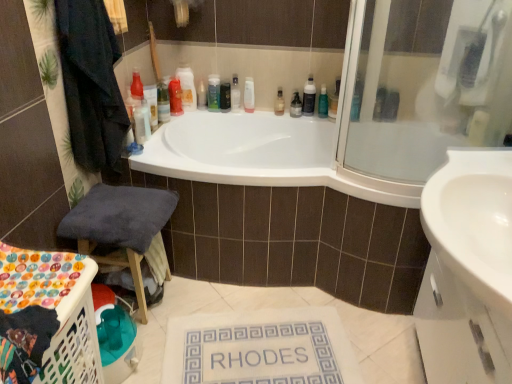
Locate an element on the screen. Image resolution: width=512 pixels, height=384 pixels. white glossy sink at lower right is located at coordinates (473, 221).

Locate an element on the screen. blue glass bottle at upper center, the 8th toiletry viewed from the left is located at coordinates (357, 99).

Find the location of `matte plastic bottle at upper center, which is the first toiletry in right-to-left order`. matte plastic bottle at upper center, which is the first toiletry in right-to-left order is located at coordinates (390, 105).

Locate an element on the screen. This screenshot has height=384, width=512. white glossy sink at lower right is located at coordinates (473, 221).

Which is more to the right, green matte bottle at upper center, the 7th toiletry positioned from the left, or matte orange bottle at upper center, the 2th cleaning product in the right-to-left sequence?

green matte bottle at upper center, the 7th toiletry positioned from the left.

Image resolution: width=512 pixels, height=384 pixels. I want to click on the 7th toiletry to the right when counting from the matte orange bottle at upper center, the 1th cleaning product in the left-to-right sequence, so click(x=323, y=103).

Is green matte bottle at upper center, the 7th toiletry positioned from the left, wider or thinner than matte orange bottle at upper center, the 1th cleaning product in the left-to-right sequence?

In the image, green matte bottle at upper center, the 7th toiletry positioned from the left, appears to be more narrow than matte orange bottle at upper center, the 1th cleaning product in the left-to-right sequence.

From a real-world perspective, who is located lower, green matte bottle at upper center, placed as the 4th toiletry when sorted from right to left, or matte orange bottle at upper center, the 1th cleaning product in the left-to-right sequence?

green matte bottle at upper center, placed as the 4th toiletry when sorted from right to left, is physically lower.

Does matte orange bottle at upper center, the 2th cleaning product in the right-to-left sequence, touch translucent plastic bottle at upper center, the 8th toiletry from the right?

No, matte orange bottle at upper center, the 2th cleaning product in the right-to-left sequence, is not in contact with translucent plastic bottle at upper center, the 8th toiletry from the right.

From a real-world perspective, between matte orange bottle at upper center, the 2th cleaning product in the right-to-left sequence, and translucent plastic bottle at upper center, the 3th toiletry from the left, who is vertically higher?

matte orange bottle at upper center, the 2th cleaning product in the right-to-left sequence.

Can you confirm if matte orange bottle at upper center, the 2th cleaning product in the right-to-left sequence, is positioned to the right of translucent plastic bottle at upper center, the 8th toiletry from the right?

No, matte orange bottle at upper center, the 2th cleaning product in the right-to-left sequence, is not to the right of translucent plastic bottle at upper center, the 8th toiletry from the right.

From a real-world perspective, who is located lower, translucent plastic bottle at upper center, the 3th toiletry from the left, or translucent plastic bottle at upper center, acting as the first toiletry starting from the left?

translucent plastic bottle at upper center, acting as the first toiletry starting from the left.

Is translucent plastic bottle at upper center, the 3th toiletry from the left, looking in the opposite direction of translucent plastic bottle at upper center, acting as the first toiletry starting from the left?

That's not correct — translucent plastic bottle at upper center, the 3th toiletry from the left, is not looking away from translucent plastic bottle at upper center, acting as the first toiletry starting from the left.

Does translucent plastic bottle at upper center, the 3th toiletry from the left, have a lesser height compared to translucent plastic bottle at upper center, which is the tenth toiletry in right-to-left order?

No, translucent plastic bottle at upper center, the 3th toiletry from the left, is not shorter than translucent plastic bottle at upper center, which is the tenth toiletry in right-to-left order.

Locate an element on the screen. toiletry located above the translucent plastic bottle at upper center, the 3th toiletry from the left (from the image's perspective) is located at coordinates (201, 95).

Does white plastic bottle at upper center, the 4th toiletry when ordered from left to right, touch green matte bottle at upper center?

No, white plastic bottle at upper center, the 4th toiletry when ordered from left to right, is not next to green matte bottle at upper center.

Is white plastic bottle at upper center, which is the seventh toiletry in right-to-left order, turned away from green matte bottle at upper center?

That's not correct — white plastic bottle at upper center, which is the seventh toiletry in right-to-left order, is not looking away from green matte bottle at upper center.

Considering the relative sizes of white plastic bottle at upper center, which is the seventh toiletry in right-to-left order, and green matte bottle at upper center in the image provided, is white plastic bottle at upper center, which is the seventh toiletry in right-to-left order, taller than green matte bottle at upper center?

No.

From the image's perspective, is white plastic bottle at upper center, which is the seventh toiletry in right-to-left order, above or below green matte bottle at upper center?

white plastic bottle at upper center, which is the seventh toiletry in right-to-left order, is below green matte bottle at upper center.

Does blue glass bottle at upper center, the 8th toiletry viewed from the left, appear on the right side of matte plastic bottle at upper center, the 9th toiletry when ordered from left to right?

Incorrect, blue glass bottle at upper center, the 8th toiletry viewed from the left, is not on the right side of matte plastic bottle at upper center, the 9th toiletry when ordered from left to right.

Consider the image. From a real-world perspective, is blue glass bottle at upper center, which is the 3th toiletry in right-to-left order, located beneath matte plastic bottle at upper center, the second toiletry from the right?

No, from a real-world perspective, blue glass bottle at upper center, which is the 3th toiletry in right-to-left order, is not below matte plastic bottle at upper center, the second toiletry from the right.

Which object is further away from the camera, blue glass bottle at upper center, which is the 3th toiletry in right-to-left order, or matte plastic bottle at upper center, the 9th toiletry when ordered from left to right?

matte plastic bottle at upper center, the 9th toiletry when ordered from left to right, is further away from the camera.

From the image's perspective, between blue glass bottle at upper center, the 8th toiletry viewed from the left, and matte plastic bottle at upper center, the 9th toiletry when ordered from left to right, which one is located above?

blue glass bottle at upper center, the 8th toiletry viewed from the left, is shown above in the image.

Is matte plastic container at upper center, the ninth toiletry when ordered from right to left, at the back of translucent plastic bottle at upper center, the 2th cleaning product when ordered from left to right?

That's not correct — translucent plastic bottle at upper center, the 2th cleaning product when ordered from left to right, is not looking away from matte plastic container at upper center, the ninth toiletry when ordered from right to left.

Where is `the 1st toiletry positioned above the translucent plastic bottle at upper center, the 2th cleaning product when ordered from left to right (from the image's perspective)`? the 1st toiletry positioned above the translucent plastic bottle at upper center, the 2th cleaning product when ordered from left to right (from the image's perspective) is located at coordinates (225, 96).

Which of these two, translucent plastic bottle at upper center, acting as the first cleaning product starting from the right, or matte plastic container at upper center, the ninth toiletry when ordered from right to left, is thinner?

A: Thinner between the two is translucent plastic bottle at upper center, acting as the first cleaning product starting from the right.

Starting from the green matte bottle at upper center, placed as the 4th toiletry when sorted from right to left, which toiletry is the 5th one behind? Please provide its 2D coordinates.

[(249, 95)]

Is white plastic bottle at upper center, which is the seventh toiletry in right-to-left order, bigger or smaller than green matte bottle at upper center, placed as the 4th toiletry when sorted from right to left?

white plastic bottle at upper center, which is the seventh toiletry in right-to-left order, is smaller than green matte bottle at upper center, placed as the 4th toiletry when sorted from right to left.

Is green matte bottle at upper center, placed as the 4th toiletry when sorted from right to left, at the back of white plastic bottle at upper center, which is the seventh toiletry in right-to-left order?

No, white plastic bottle at upper center, which is the seventh toiletry in right-to-left order, is not facing the opposite direction of green matte bottle at upper center, placed as the 4th toiletry when sorted from right to left.

This screenshot has height=384, width=512. I want to click on the 7th toiletry below when counting from the matte orange bottle at upper center, the 2th cleaning product in the right-to-left sequence (from the image's perspective), so click(x=323, y=103).

I want to click on cleaning product on the left of the translucent plastic bottle at upper center, the 8th toiletry from the right, so click(x=187, y=87).

From the image, which object appears to be nearer to translucent plastic bottle at upper center, which is the tenth toiletry in right-to-left order, green matte bottle at upper center or white plastic bottle at upper center, the 4th toiletry when ordered from left to right?

green matte bottle at upper center is positioned closer to the anchor translucent plastic bottle at upper center, which is the tenth toiletry in right-to-left order.

Considering their positions, is green matte bottle at upper center positioned further to translucent plastic bottle at upper center, the 2th cleaning product when ordered from left to right, than translucent plastic soap dispenser at upper center, which is counted as the fifth toiletry, starting from the right?

The object further to translucent plastic bottle at upper center, the 2th cleaning product when ordered from left to right, is green matte bottle at upper center.

Looking at the image, which one is located closer to matte orange bottle at upper center, the 1th cleaning product in the left-to-right sequence, translucent plastic bottle at upper center, the 2th cleaning product when ordered from left to right, or matte plastic bottle at upper center, the 9th toiletry when ordered from left to right?

The object closer to matte orange bottle at upper center, the 1th cleaning product in the left-to-right sequence, is translucent plastic bottle at upper center, the 2th cleaning product when ordered from left to right.

Looking at this image, looking at the image, which one is located closer to translucent plastic soap dispenser at upper center, arranged as the sixth toiletry when viewed from the right, white fabric bath mat at center or translucent plastic bottle at upper center, the 2th cleaning product when ordered from left to right?

The object closer to translucent plastic soap dispenser at upper center, arranged as the sixth toiletry when viewed from the right, is translucent plastic bottle at upper center, the 2th cleaning product when ordered from left to right.

Which object lies nearer to the anchor point translucent plastic soap dispenser at upper center, marked as the 5th toiletry in a left-to-right arrangement, translucent plastic bottle at upper center, the 2th cleaning product when ordered from left to right, or translucent plastic bottle at upper center, which is the tenth toiletry in right-to-left order?

Based on the image, translucent plastic bottle at upper center, the 2th cleaning product when ordered from left to right, appears to be nearer to translucent plastic soap dispenser at upper center, marked as the 5th toiletry in a left-to-right arrangement.

From the image, which object appears to be nearer to matte plastic bottle at upper center, the second toiletry from the right, translucent plastic soap dispenser at upper center, which is counted as the fifth toiletry, starting from the right, or translucent plastic bottle at upper center, the 2th cleaning product when ordered from left to right?

translucent plastic bottle at upper center, the 2th cleaning product when ordered from left to right, lies closer to matte plastic bottle at upper center, the second toiletry from the right, than the other object.

Looking at the image, which one is located further to matte plastic container at upper center, the ninth toiletry when ordered from right to left, matte plastic bottle at upper center, the 9th toiletry when ordered from left to right, or matte orange bottle at upper center, the 1th cleaning product in the left-to-right sequence?

matte plastic bottle at upper center, the 9th toiletry when ordered from left to right, lies further to matte plastic container at upper center, the ninth toiletry when ordered from right to left, than the other object.

Looking at the image, which one is located further to green matte bottle at upper center, placed as the 4th toiletry when sorted from right to left, white fabric bath mat at center or translucent plastic bottle at upper center, acting as the first toiletry starting from the left?

white fabric bath mat at center.

This screenshot has height=384, width=512. Identify the location of chair between green matte bottle at upper center, placed as the 4th toiletry when sorted from right to left, and white fabric bath mat at center from top to bottom. (120, 227).

I want to click on bath mat between white plastic laundry basket at lower left and matte plastic bottle at upper center, the 9th toiletry when ordered from left to right, from left to right, so click(260, 348).

Identify the location of cleaning product between matte orange bottle at upper center, the 1th cleaning product in the left-to-right sequence, and matte plastic bottle at upper center, which is the tenth toiletry from left to right, from left to right. (309, 97).

Locate an element on the screen. The width and height of the screenshot is (512, 384). cleaning product between matte plastic container at upper center, the ninth toiletry when ordered from right to left, and matte plastic bottle at upper center, which is the first toiletry in right-to-left order, in the horizontal direction is located at coordinates (309, 97).